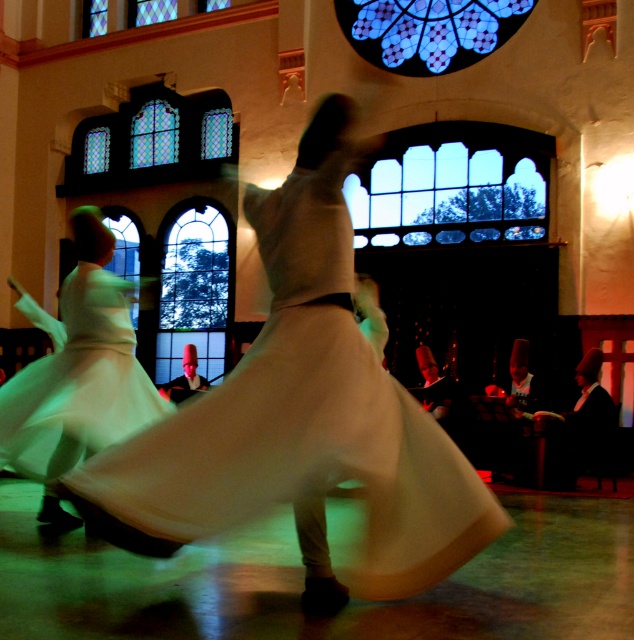
You are an interior designer planning to install a new lighting fixture in the grand historic building. You have two options for placement based on the existing stained glass windows. The first option requires a space wider than the stained glass window at center, and the second option needs a space wider than the blue stained glass at upper center. Which option is feasible?

The blue stained glass at upper center is wider than the stained glass window at center. Therefore, the second option requiring a space wider than the blue stained glass at upper center is not feasible. The first option, which requires a space wider than the stained glass window at center, is feasible since the stained glass window at center is narrower.

You are standing in the grand hall of the mosque and want to take a photo of the stained glass windows. The stained glass window at center and the stained glass window at upper left are both in your view. Which window is positioned higher up in the image?

The stained glass window at upper left is positioned higher up in the image than the stained glass window at center.